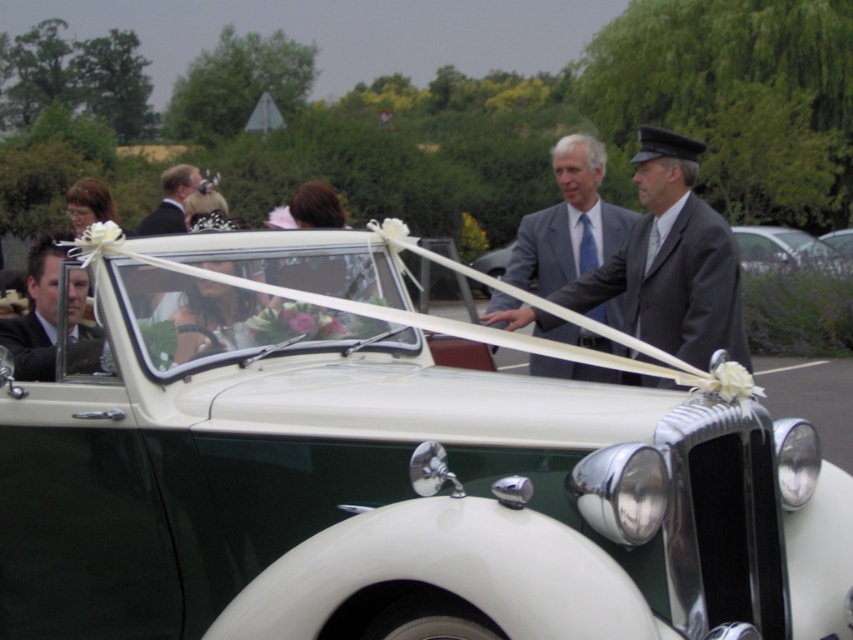
You are a photographer at a wedding event and need to capture a photo of both the matte gray suit at center and the matte black suit at left. Since you want to ensure both are in focus, which one should you focus on first to maintain depth of field?

You should focus on the matte gray suit at center first because it is closer to you than the matte black suit at left, ensuring both are in focus with proper depth of field.

You are a photographer at a wedding and need to position two guests wearing the matte gray suit at center and the matte black suit at center. According to the scene, which guest should stand on the left side when facing the vintage car?

The matte black suit at center should stand on the left side because the matte gray suit at center is to the right of it in the original scene.

You are planning to place a 2.5 meter long banner between the matte gray suit at center and the matte black suit at center. Will the banner fit without overlapping either of the suits?

The distance between the matte gray suit at center and the matte black suit at center is 3.37 meters. Since the banner is 2.5 meters long, it will fit between them without overlapping either suit as there is sufficient space.